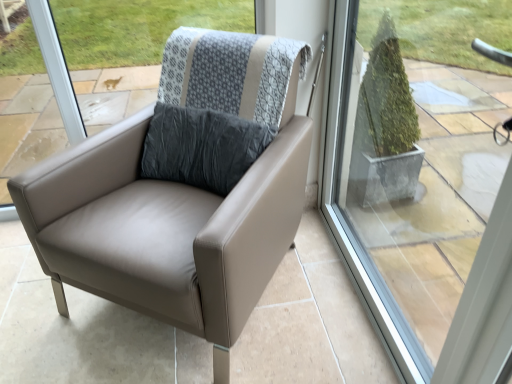
Question: Could you tell me if matte leather chair at center is facing transparent glass window at center?

Choices:
 (A) no
 (B) yes

Answer: (A)

Question: From a real-world perspective, is matte leather chair at center located beneath transparent glass window at center?

Choices:
 (A) no
 (B) yes

Answer: (B)

Question: Considering the relative sizes of matte leather chair at center and transparent glass window at center in the image provided, is matte leather chair at center bigger than transparent glass window at center?

Choices:
 (A) no
 (B) yes

Answer: (B)

Question: Can you see matte leather chair at center touching transparent glass window at center?

Choices:
 (A) yes
 (B) no

Answer: (B)

Question: From the image's perspective, would you say matte leather chair at center is positioned over transparent glass window at center?

Choices:
 (A) yes
 (B) no

Answer: (A)

Question: Considering the relative sizes of matte leather chair at center and transparent glass window at center in the image provided, is matte leather chair at center shorter than transparent glass window at center?

Choices:
 (A) no
 (B) yes

Answer: (B)

Question: Is transparent glass window at center further to camera compared to matte leather chair at center?

Choices:
 (A) yes
 (B) no

Answer: (B)

Question: Can you confirm if transparent glass window at center is wider than matte leather chair at center?

Choices:
 (A) no
 (B) yes

Answer: (A)

Question: From a real-world perspective, is transparent glass window at center physically above matte leather chair at center?

Choices:
 (A) yes
 (B) no

Answer: (A)

Question: Is transparent glass window at center positioned with its back to matte leather chair at center?

Choices:
 (A) yes
 (B) no

Answer: (A)

Question: Could you tell me if transparent glass window at center is turned towards matte leather chair at center?

Choices:
 (A) yes
 (B) no

Answer: (A)

Question: From the image's perspective, is transparent glass window at center above matte leather chair at center?

Choices:
 (A) no
 (B) yes

Answer: (A)

Question: Is matte leather chair at center in front of or behind transparent glass window at center in the image?

Choices:
 (A) behind
 (B) front

Answer: (A)